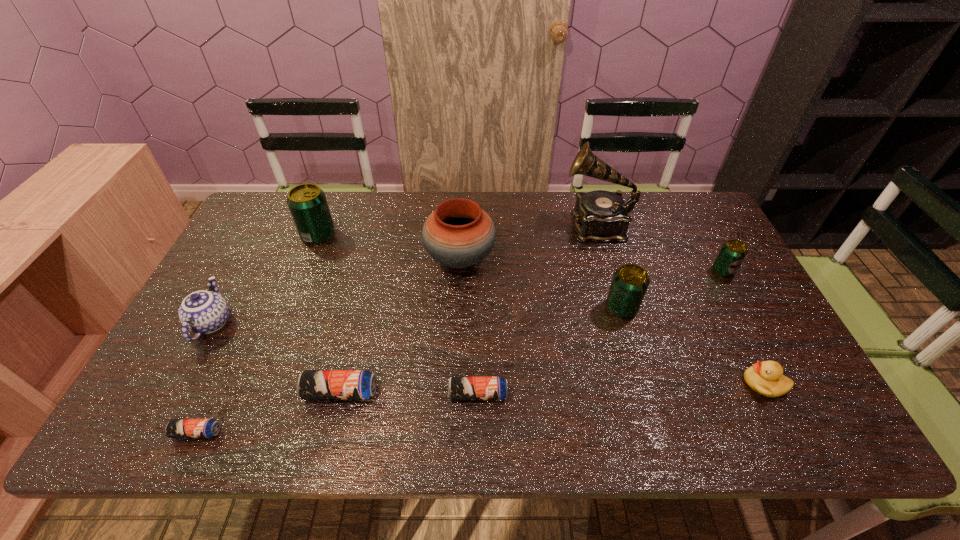
Find the location of `vacant area that lies between the rightmost green beer can and the pottery`. vacant area that lies between the rightmost green beer can and the pottery is located at coordinates (591, 265).

Where is `vacant space in between the chinaware and the second farthest beer can`? The image size is (960, 540). vacant space in between the chinaware and the second farthest beer can is located at coordinates (468, 297).

The image size is (960, 540). Find the location of `free space that is in between the third shortest beer can and the shortest beer can`. free space that is in between the third shortest beer can and the shortest beer can is located at coordinates (269, 412).

You are a GUI agent. You are given a task and a screenshot of the screen. Output one action in this format:
    pyautogui.click(x=<x>, y=<y>)
    Task: Click on the vacant area between the blue chinaware and the second shortest object
    The height and width of the screenshot is (540, 960).
    Given the screenshot: What is the action you would take?
    pyautogui.click(x=345, y=359)

Find the location of `empty space that is in between the blue chinaware and the shortest beer can`. empty space that is in between the blue chinaware and the shortest beer can is located at coordinates (204, 377).

Identify the location of free area in between the chinaware and the phonograph record. (404, 274).

Identify which object is located as the fifth nearest to the nearest green beer can. Please provide its 2D coordinates. Your answer should be formatted as a tuple, i.e. [(x, y)], where the tuple contains the x and y coordinates of a point satisfying the conditions above.

[(459, 388)]

Locate an element on the screen. Image resolution: width=960 pixels, height=540 pixels. object that can be found as the ninth closest to the third beer can from left to right is located at coordinates (732, 253).

Locate an element on the screen. The image size is (960, 540). beer can that is the fourth closest to the tallest beer can is located at coordinates (630, 282).

Locate which beer can ranks fourth in proximity to the tallest beer can. Please provide its 2D coordinates. Your answer should be formatted as a tuple, i.e. [(x, y)], where the tuple contains the x and y coordinates of a point satisfying the conditions above.

[(630, 282)]